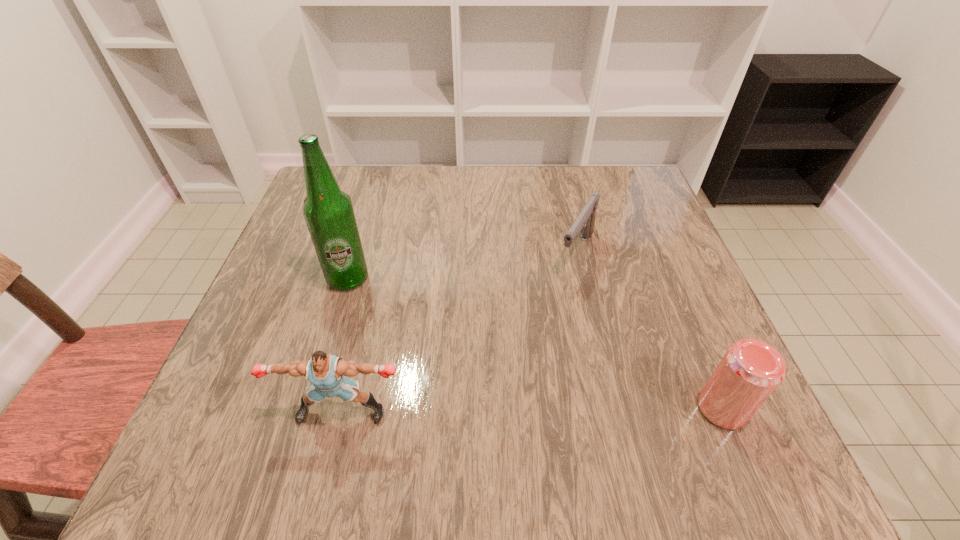
Image resolution: width=960 pixels, height=540 pixels. Identify the location of puncher. (325, 373).

Find the location of a particular element. Image resolution: width=960 pixels, height=540 pixels. beer can is located at coordinates (750, 371).

Locate an element on the screen. pistol is located at coordinates (585, 222).

Where is `the second object from right to left`? This screenshot has width=960, height=540. the second object from right to left is located at coordinates (585, 222).

Locate an element on the screen. This screenshot has height=540, width=960. beer bottle is located at coordinates (328, 211).

Identify the location of free space located 0.260m on the left of the rightmost object. The height and width of the screenshot is (540, 960). (543, 408).

Locate an element on the screen. This screenshot has width=960, height=540. vacant space situated 0.360m at the barrel of the third object from left to right is located at coordinates (492, 408).

This screenshot has height=540, width=960. Identify the location of vacant area situated 0.150m at the barrel of the third object from left to right. pos(542,322).

Where is `free spot located 0.200m at the barrel of the third object from left to right`? This screenshot has width=960, height=540. free spot located 0.200m at the barrel of the third object from left to right is located at coordinates (532, 341).

Where is `vacant space located 0.340m on the label of the tallest object`? Image resolution: width=960 pixels, height=540 pixels. vacant space located 0.340m on the label of the tallest object is located at coordinates point(490,373).